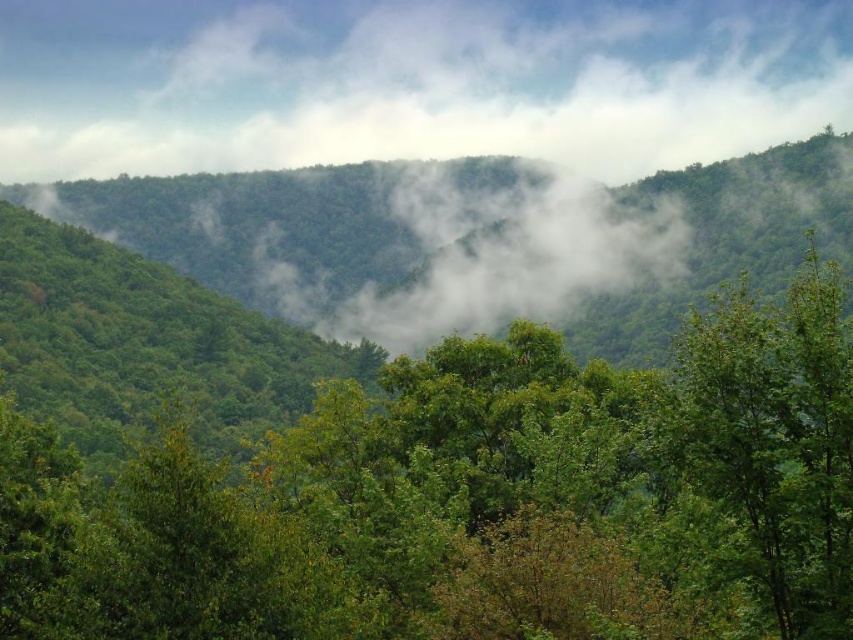
Question: In this image, where is green leafy tree at center located relative to white misty cloud at upper center?

Choices:
 (A) below
 (B) above

Answer: (A)

Question: Which of the following is the closest to the observer?

Choices:
 (A) coord(491,296)
 (B) coord(221,486)

Answer: (B)

Question: Is white misty cloud at upper center bigger than white fluffy cloud at center?

Choices:
 (A) no
 (B) yes

Answer: (B)

Question: Which object appears farthest from the camera in this image?

Choices:
 (A) green leafy tree at center
 (B) white misty cloud at upper center
 (C) white fluffy cloud at center

Answer: (B)

Question: Which point appears closest to the camera in this image?

Choices:
 (A) (553, 193)
 (B) (473, 634)

Answer: (B)

Question: Does green leafy tree at center have a larger size compared to white fluffy cloud at center?

Choices:
 (A) yes
 (B) no

Answer: (B)